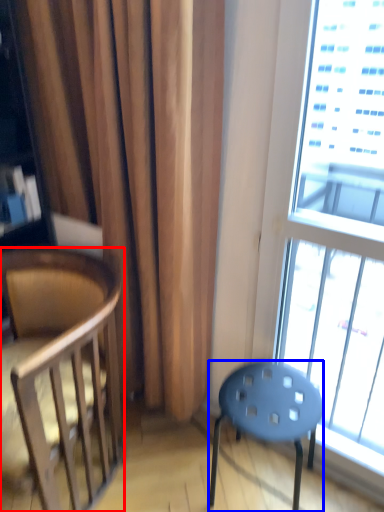
Question: Among these objects, which one is nearest to the camera, chair (highlighted by a red box) or stool (highlighted by a blue box)?

Choices:
 (A) chair
 (B) stool

Answer: (A)